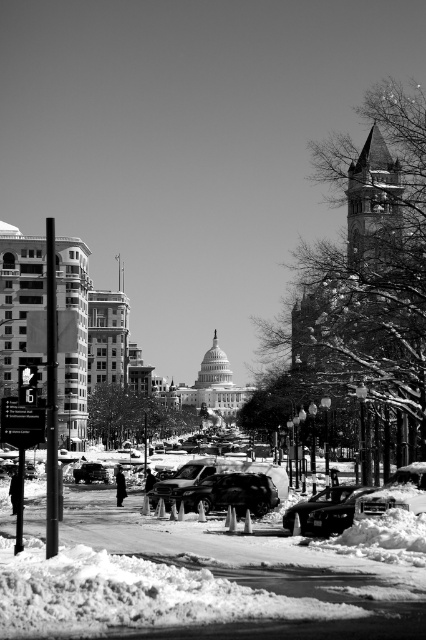
Question: Which object is the closest to the shiny black sedan at center?

Choices:
 (A) shiny silver sedan at lower left
 (B) shiny black suv at center

Answer: (B)

Question: Which is nearer to the shiny silver sedan at lower left?

Choices:
 (A) shiny black sedan at center
 (B) shiny black suv at center

Answer: (B)

Question: In this image, where is shiny black suv at center located relative to shiny silver sedan at lower left?

Choices:
 (A) below
 (B) above

Answer: (B)

Question: Can you confirm if shiny black suv at center is smaller than shiny silver sedan at lower left?

Choices:
 (A) yes
 (B) no

Answer: (B)

Question: Does shiny black suv at center have a larger size compared to shiny silver sedan at lower left?

Choices:
 (A) yes
 (B) no

Answer: (A)

Question: Which is farther from the shiny black sedan at center?

Choices:
 (A) shiny silver sedan at lower left
 (B) shiny black suv at center

Answer: (A)